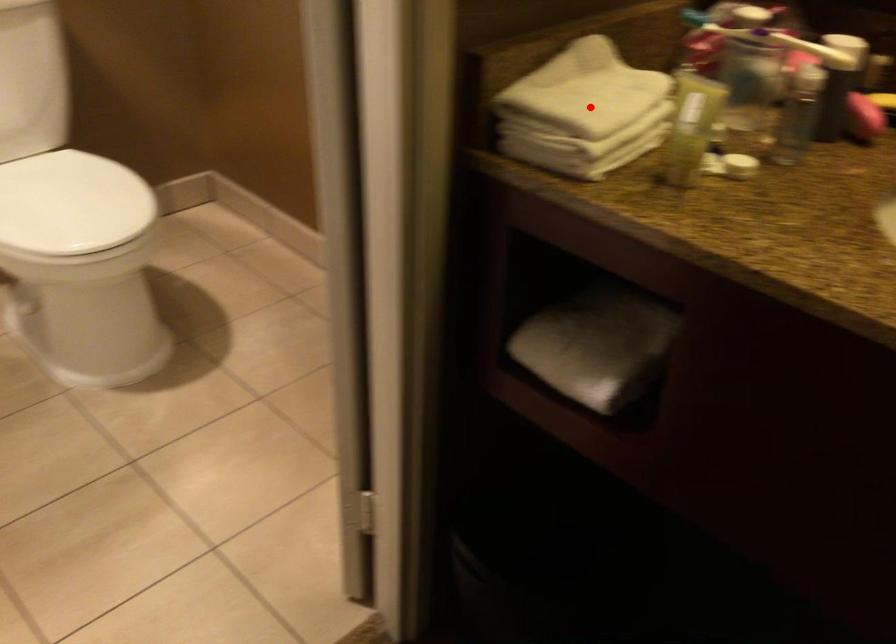
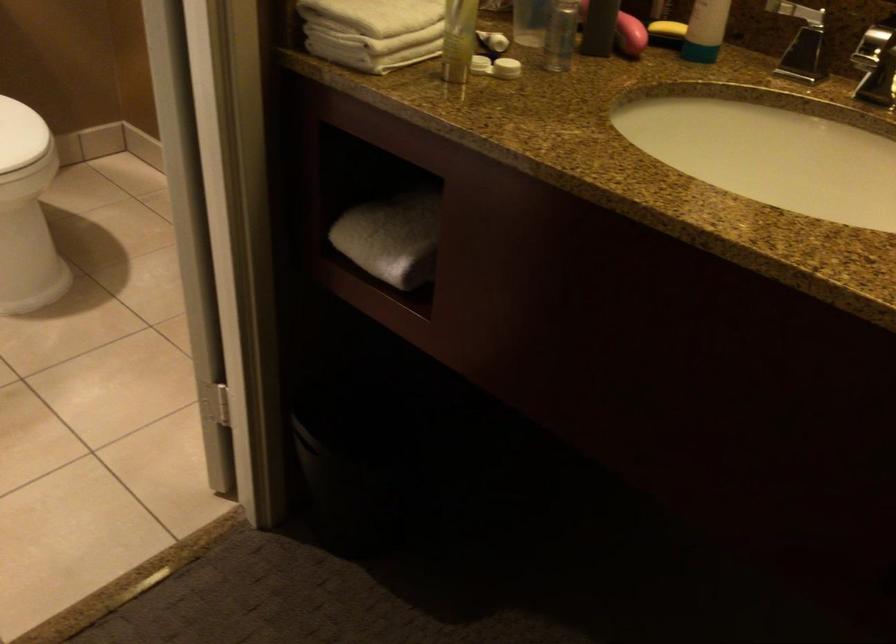
In the second image, find the point that corresponds to the highlighted location in the first image.

(380, 14)